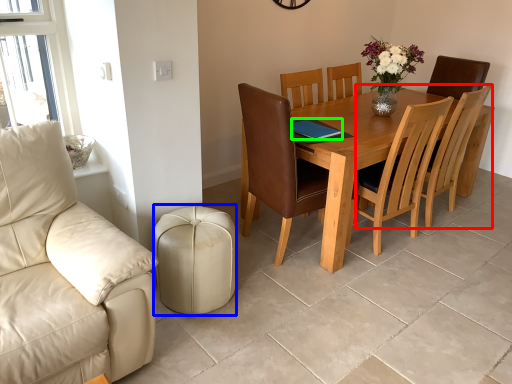
Question: Which is farther away from chair (highlighted by a red box)? stool (highlighted by a blue box) or pad (highlighted by a green box)?

Choices:
 (A) stool
 (B) pad

Answer: (A)